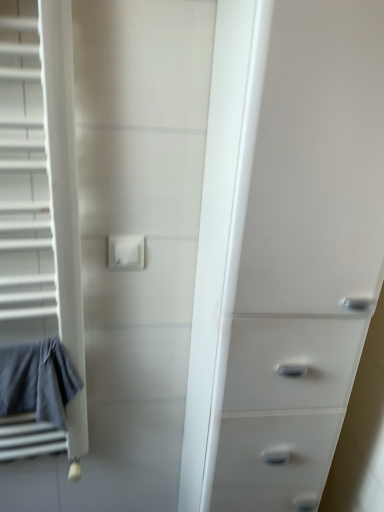
Question: Is the position of white plastic electric outlet at center less distant than that of gray cotton bath towel at left?

Choices:
 (A) yes
 (B) no

Answer: (B)

Question: Is white plastic electric outlet at center positioned with its back to gray cotton bath towel at left?

Choices:
 (A) no
 (B) yes

Answer: (A)

Question: Considering the relative sizes of white plastic electric outlet at center and gray cotton bath towel at left in the image provided, is white plastic electric outlet at center wider than gray cotton bath towel at left?

Choices:
 (A) no
 (B) yes

Answer: (A)

Question: Is white plastic electric outlet at center smaller than gray cotton bath towel at left?

Choices:
 (A) yes
 (B) no

Answer: (A)

Question: Can you confirm if white plastic electric outlet at center is taller than gray cotton bath towel at left?

Choices:
 (A) yes
 (B) no

Answer: (B)

Question: Would you say white plastic chest of drawers at right is to the left or to the right of white plastic electric outlet at center in the picture?

Choices:
 (A) left
 (B) right

Answer: (B)

Question: Is white plastic chest of drawers at right taller or shorter than white plastic electric outlet at center?

Choices:
 (A) tall
 (B) short

Answer: (A)

Question: From the image's perspective, relative to white plastic electric outlet at center, is white plastic chest of drawers at right above or below?

Choices:
 (A) above
 (B) below

Answer: (B)

Question: From a real-world perspective, relative to white plastic electric outlet at center, is white plastic chest of drawers at right vertically above or below?

Choices:
 (A) below
 (B) above

Answer: (A)

Question: Is white plastic chest of drawers at right to the left or to the right of gray cotton bath towel at left in the image?

Choices:
 (A) left
 (B) right

Answer: (B)

Question: In terms of width, does white plastic chest of drawers at right look wider or thinner when compared to gray cotton bath towel at left?

Choices:
 (A) thin
 (B) wide

Answer: (B)

Question: Based on their sizes in the image, would you say white plastic chest of drawers at right is bigger or smaller than gray cotton bath towel at left?

Choices:
 (A) big
 (B) small

Answer: (A)

Question: In the image, is white plastic chest of drawers at right positioned in front of or behind gray cotton bath towel at left?

Choices:
 (A) behind
 (B) front

Answer: (B)

Question: Is white plastic electric outlet at center bigger or smaller than gray cotton bath towel at left?

Choices:
 (A) big
 (B) small

Answer: (B)

Question: Looking at their shapes, would you say white plastic electric outlet at center is wider or thinner than gray cotton bath towel at left?

Choices:
 (A) wide
 (B) thin

Answer: (B)